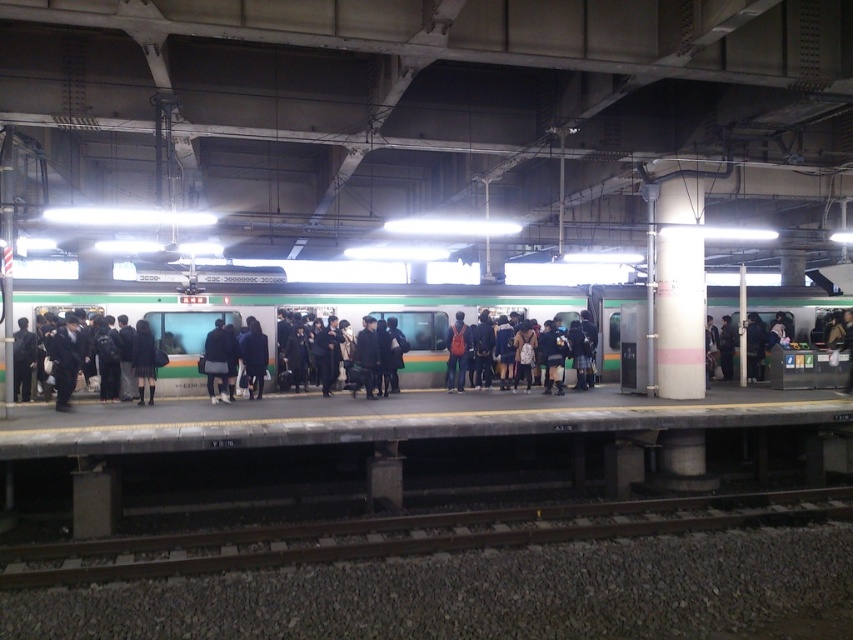
Question: Which object is the farthest from the dark gray fabric jacket at center?

Choices:
 (A) dark blue jacket at center
 (B) smooth metal train track at lower center
 (C) orange backpack at center

Answer: (B)

Question: Is smooth metal train track at lower center behind dark gray fabric jacket at center?

Choices:
 (A) yes
 (B) no

Answer: (B)

Question: Which point is farther to the camera?

Choices:
 (A) (257, 340)
 (B) (134, 358)
 (C) (213, 372)

Answer: (A)

Question: Can you confirm if smooth metal train track at lower center is smaller than orange backpack at center?

Choices:
 (A) yes
 (B) no

Answer: (B)

Question: Can you confirm if green matte train at center is positioned above dark gray fabric jacket at center?

Choices:
 (A) yes
 (B) no

Answer: (A)

Question: Which point is closer to the camera?

Choices:
 (A) orange backpack at center
 (B) dark gray fabric jacket at center

Answer: (B)